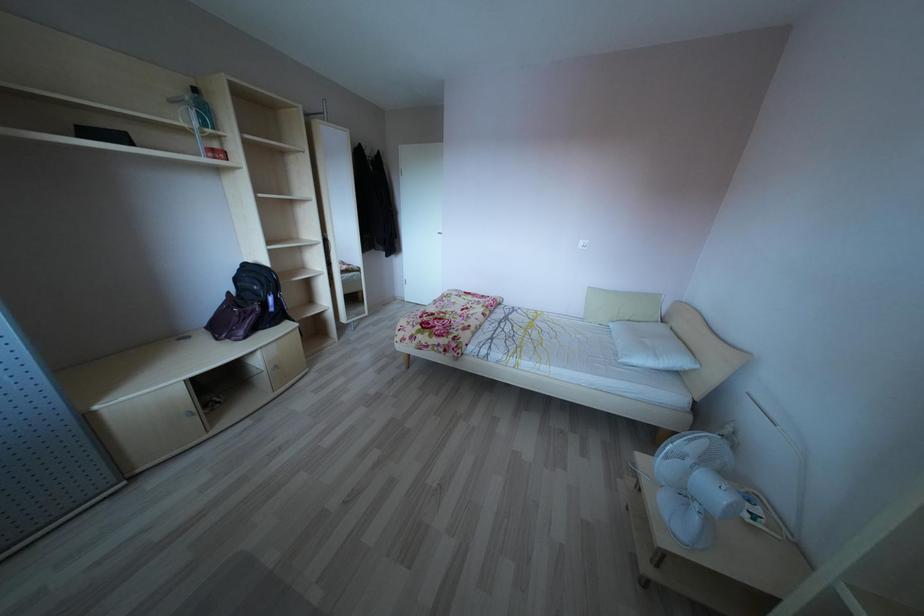
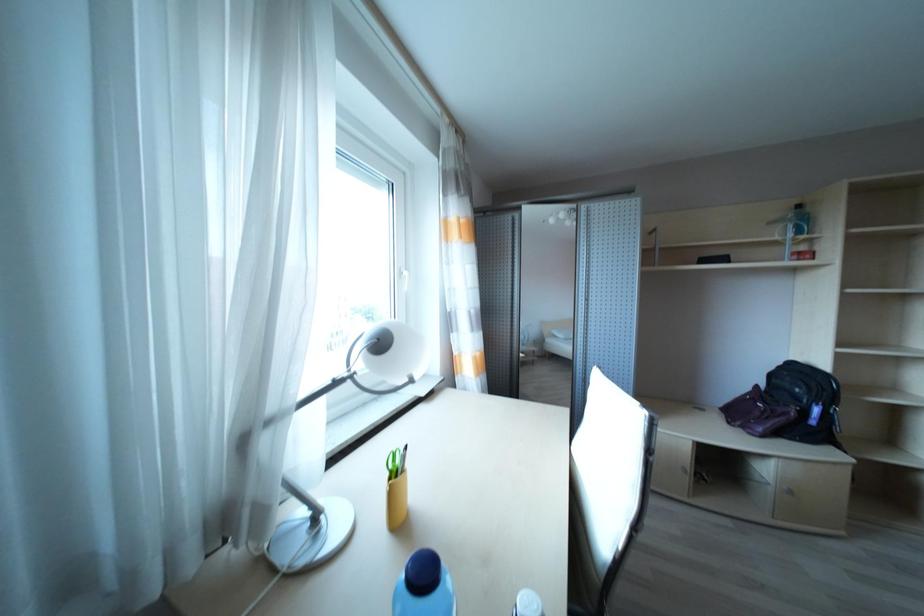
Question: The images are taken continuously from a first-person perspective. In which direction is your viewpoint rotating?

Choices:
 (A) Left
 (B) Right
 (C) Up
 (D) Down

Answer: (A)